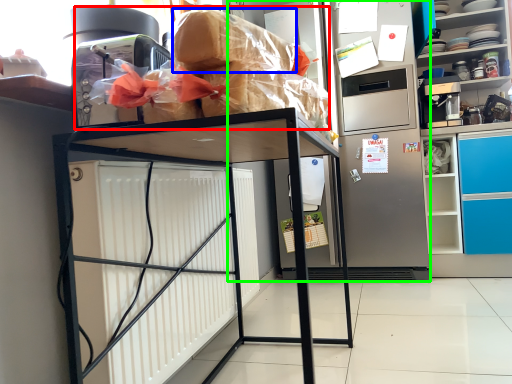
Question: Considering the real-world distances, which object is closest to stuff (highlighted by a red box)? bread (highlighted by a blue box) or appliance (highlighted by a green box).

Choices:
 (A) bread
 (B) appliance

Answer: (A)